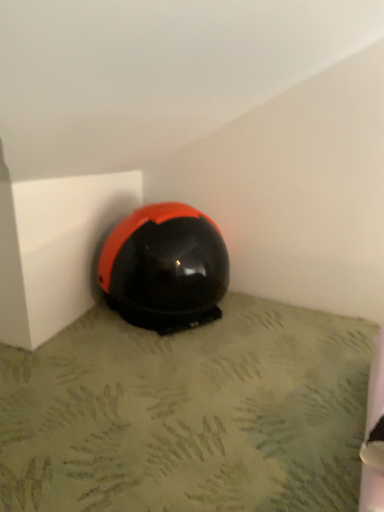
Locate an element on the screen. The image size is (384, 512). free space above black matte helmet at center (from a real-world perspective) is located at coordinates (175, 380).